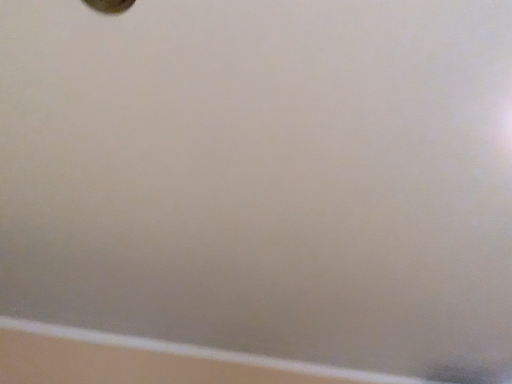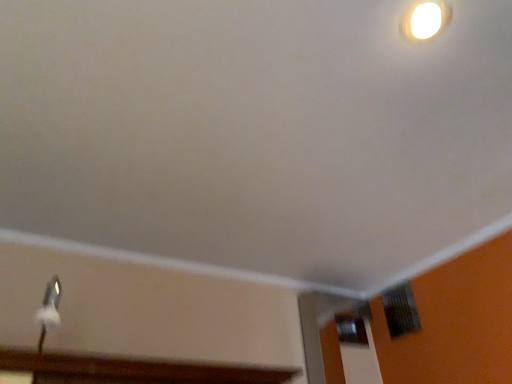
Question: How did the camera likely rotate when shooting the video?

Choices:
 (A) rotated right
 (B) rotated left

Answer: (A)